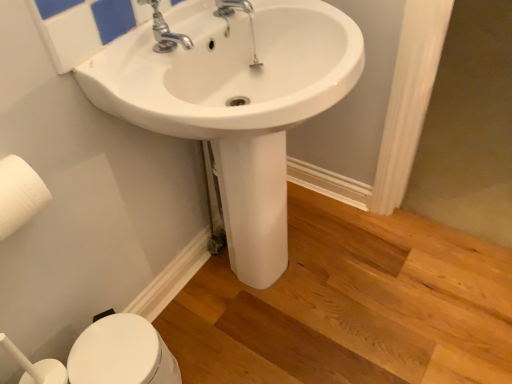
Question: Relative to white glossy sink at center, is white matte toilet paper at left in front or behind?

Choices:
 (A) front
 (B) behind

Answer: (B)

Question: Is white matte toilet paper at left situated inside white glossy sink at center or outside?

Choices:
 (A) inside
 (B) outside

Answer: (B)

Question: Which object is positioned closest to the white matte toilet paper at left?

Choices:
 (A) white glossy bidet at lower left
 (B) white glossy sink at center
 (C) polished chrome faucet at upper center

Answer: (C)

Question: Which is farther from the white matte toilet paper at left?

Choices:
 (A) polished chrome faucet at upper center
 (B) white glossy bidet at lower left
 (C) white glossy sink at center

Answer: (C)